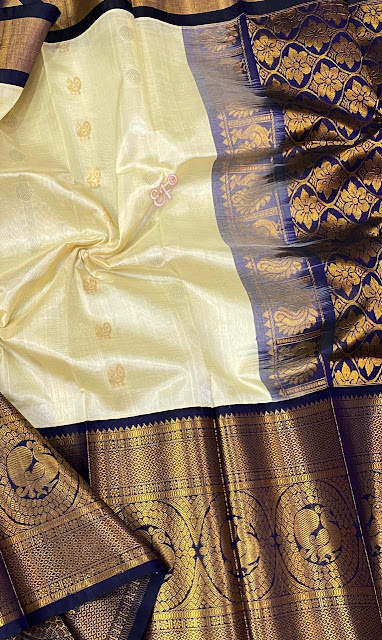
At what (x,y) coordinates should I click in order to perform the action: click on creamy gold fabric. Please return your answer as a coordinate pair (x, y). The width and height of the screenshot is (382, 640). Looking at the image, I should click on (205, 276).